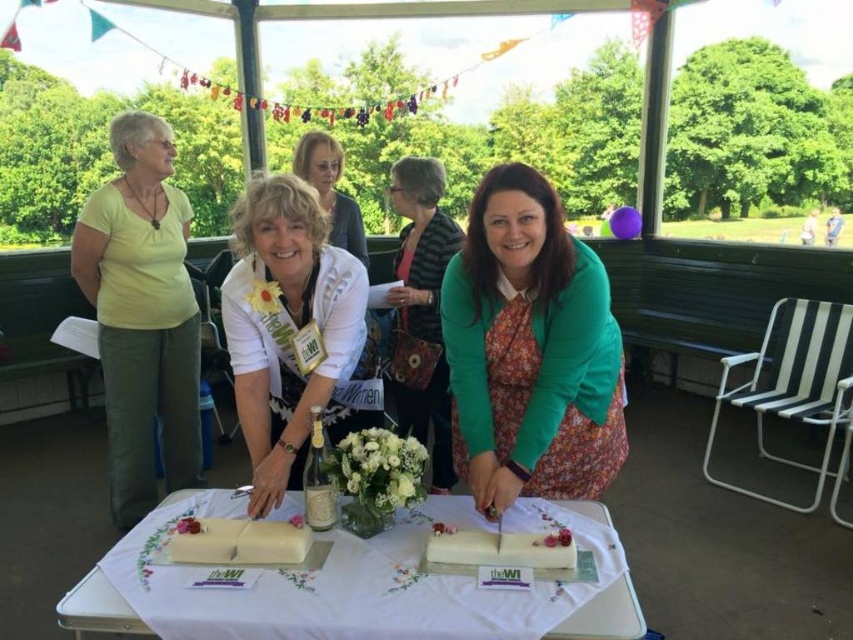
You are a photographer at the event and need to capture a clear shot of both the green fabric dress at center and the white cream cake at center. However, the dress is partially blocking the cake. Can you adjust your position to ensure both are fully visible without any obstruction?

The green fabric dress at center is positioned over white cream cake at center, so moving the camera angle slightly downward or to the side would allow both to be visible without obstruction.

You are a photographer planning to take a group photo of the event. You need to position yourself so that the white fabric tablecloth at center and the matte black jacket at upper center are both clearly visible in the frame. What is the minimum distance you should keep between these two objects in your photo?

The white fabric tablecloth at center is 6.08 feet from the matte black jacket at upper center, so the minimum distance you should keep between them in your photo is at least 6.08 feet to ensure both are clearly visible.

You are a guest at the event and want to take a photo of both the white matte cake at lower center and the white cream cake at center. Which cake should you move closer to in order to get a clearer picture of its details?

To capture clearer details of the white matte cake at lower center, you should move closer to it since it is closer to you than the white cream cake at center.